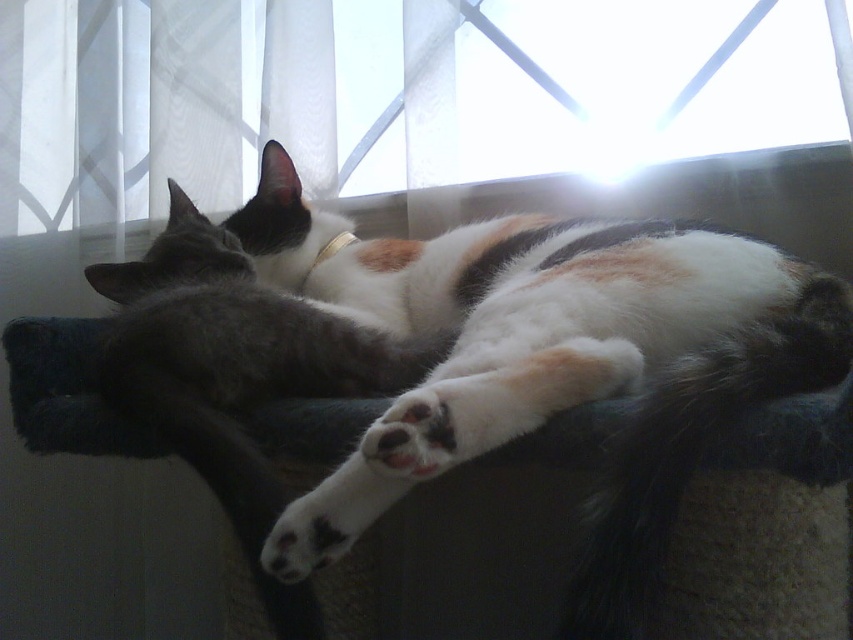
Does white fur at center have a greater height compared to transparent glass window at upper center?

Correct, white fur at center is much taller as transparent glass window at upper center.

The height and width of the screenshot is (640, 853). I want to click on white fur at center, so click(x=548, y=358).